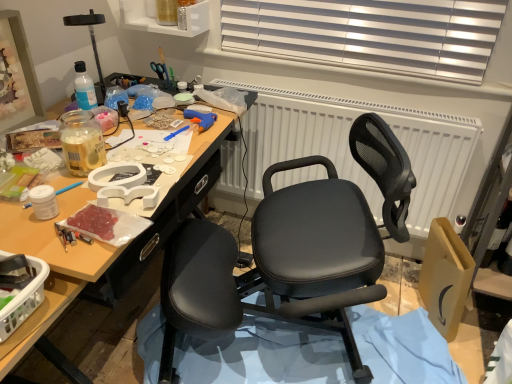
Question: Is translucent plastic basket at lower left at the left side of white textured radiator at center?

Choices:
 (A) no
 (B) yes

Answer: (B)

Question: Can you confirm if translucent plastic basket at lower left is bigger than white textured radiator at center?

Choices:
 (A) no
 (B) yes

Answer: (A)

Question: Is translucent plastic basket at lower left positioned before white textured radiator at center?

Choices:
 (A) no
 (B) yes

Answer: (B)

Question: From a real-world perspective, does translucent plastic basket at lower left stand above white textured radiator at center?

Choices:
 (A) no
 (B) yes

Answer: (B)

Question: Is the depth of translucent plastic basket at lower left greater than that of white textured radiator at center?

Choices:
 (A) yes
 (B) no

Answer: (B)

Question: Considering the relative positions of translucent plastic basket at lower left and white textured radiator at center in the image provided, is translucent plastic basket at lower left to the right of white textured radiator at center from the viewer's perspective?

Choices:
 (A) yes
 (B) no

Answer: (B)

Question: Is clear plastic bottle at upper center with translucent plastic basket at lower left?

Choices:
 (A) no
 (B) yes

Answer: (A)

Question: From a real-world perspective, is clear plastic bottle at upper center below translucent plastic basket at lower left?

Choices:
 (A) no
 (B) yes

Answer: (A)

Question: Considering the relative sizes of clear plastic bottle at upper center and translucent plastic basket at lower left in the image provided, is clear plastic bottle at upper center taller than translucent plastic basket at lower left?

Choices:
 (A) yes
 (B) no

Answer: (B)

Question: Is clear plastic bottle at upper center to the left of translucent plastic basket at lower left from the viewer's perspective?

Choices:
 (A) no
 (B) yes

Answer: (A)

Question: Could you tell me if clear plastic bottle at upper center is facing translucent plastic basket at lower left?

Choices:
 (A) no
 (B) yes

Answer: (B)

Question: Considering the relative positions of clear plastic bottle at upper center and translucent plastic basket at lower left in the image provided, is clear plastic bottle at upper center to the right of translucent plastic basket at lower left from the viewer's perspective?

Choices:
 (A) yes
 (B) no

Answer: (A)

Question: Can you confirm if clear plastic bottle at upper center is bigger than white textured radiator at center?

Choices:
 (A) no
 (B) yes

Answer: (A)